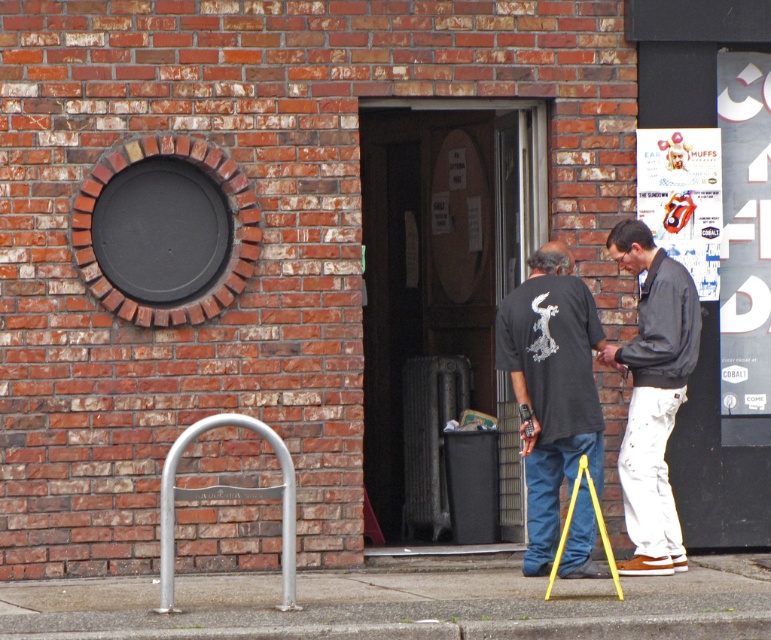
Is black matte t-shirt at center below silver metallic bike rack at lower left?

No.

Between black matte t-shirt at center and silver metallic bike rack at lower left, which one appears on the right side from the viewer's perspective?

black matte t-shirt at center is more to the right.

Measure the distance between point (601, 460) and camera.

The distance of point (601, 460) from camera is 9.61 meters.

Where is `black matte t-shirt at center`? Image resolution: width=771 pixels, height=640 pixels. black matte t-shirt at center is located at coordinates (551, 387).

Does light gray cotton jacket at right have a lesser height compared to silver metallic bike rack at lower left?

Incorrect, light gray cotton jacket at right's height does not fall short of silver metallic bike rack at lower left's.

How distant is light gray cotton jacket at right from silver metallic bike rack at lower left?

A distance of 2.00 meters exists between light gray cotton jacket at right and silver metallic bike rack at lower left.

Is point (678, 275) behind point (251, 426)?

Yes, point (678, 275) is farther from viewer.

Where is `light gray cotton jacket at right`? The width and height of the screenshot is (771, 640). light gray cotton jacket at right is located at coordinates (652, 396).

This screenshot has height=640, width=771. What do you see at coordinates (403, 605) in the screenshot?
I see `concrete at lower center` at bounding box center [403, 605].

Can you confirm if concrete at lower center is wider than black matte t-shirt at center?

Yes.

Which is in front, point (103, 628) or point (539, 476)?

Point (103, 628)

The image size is (771, 640). In order to click on concrete at lower center in this screenshot , I will do `click(403, 605)`.